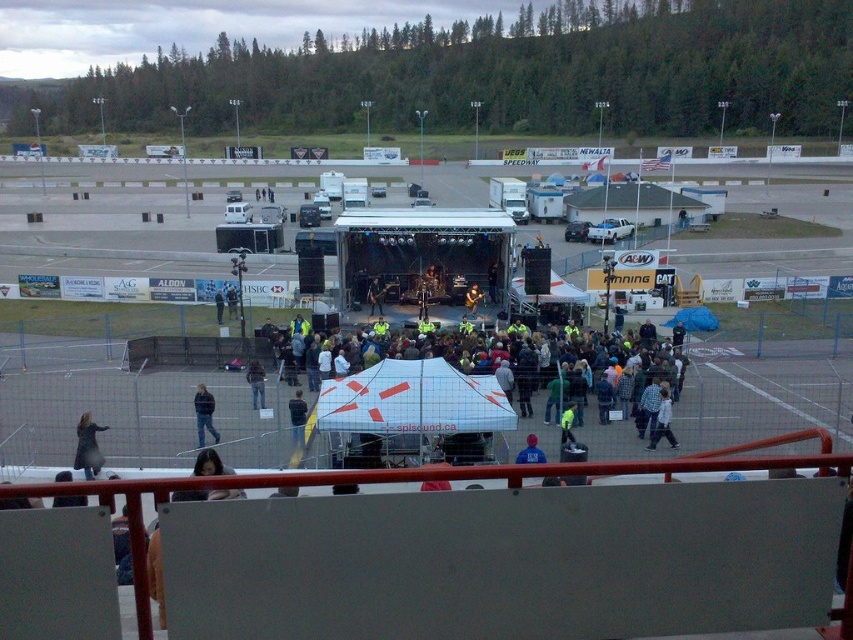
You are a photographer at the concert and want to capture a photo that includes both the black leather jacket at lower left and the dark blue jacket at center. The camera you are using has a maximum focus range of 12 feet. Will you be able to capture both jackets in focus without moving closer?

The black leather jacket at lower left is 13.39 feet away from the dark blue jacket at center. Since the distance between them exceeds the camera maximum focus range of 12 feet, you will not be able to capture both jackets in focus without moving closer.

You are a photographer at the concert and want to capture a photo of the blue denim jeans at lower left and the blue fabric at center. Can you see both objects clearly in the same frame?

The blue denim jeans at lower left is positioned over blue fabric at center, so the blue denim jeans at lower left may block the view of the blue fabric at center, making it difficult to see both clearly in the same frame.